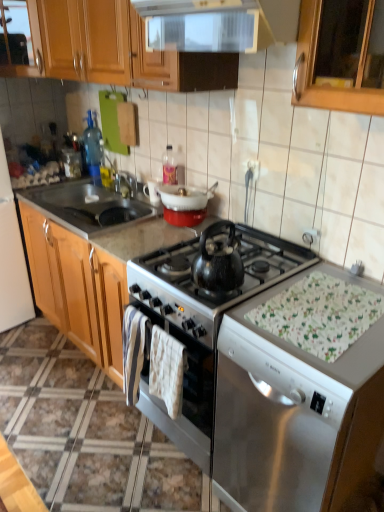
Locate an element on the screen. Image resolution: width=384 pixels, height=512 pixels. free location to the left of satin black kettle at center, which appears as the 2th appliance when viewed from the left is located at coordinates (97, 439).